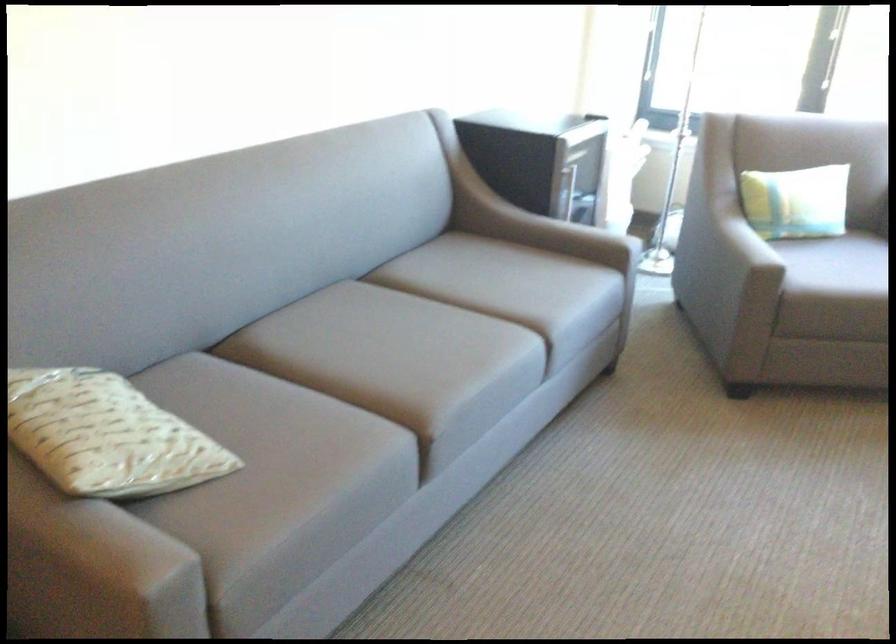
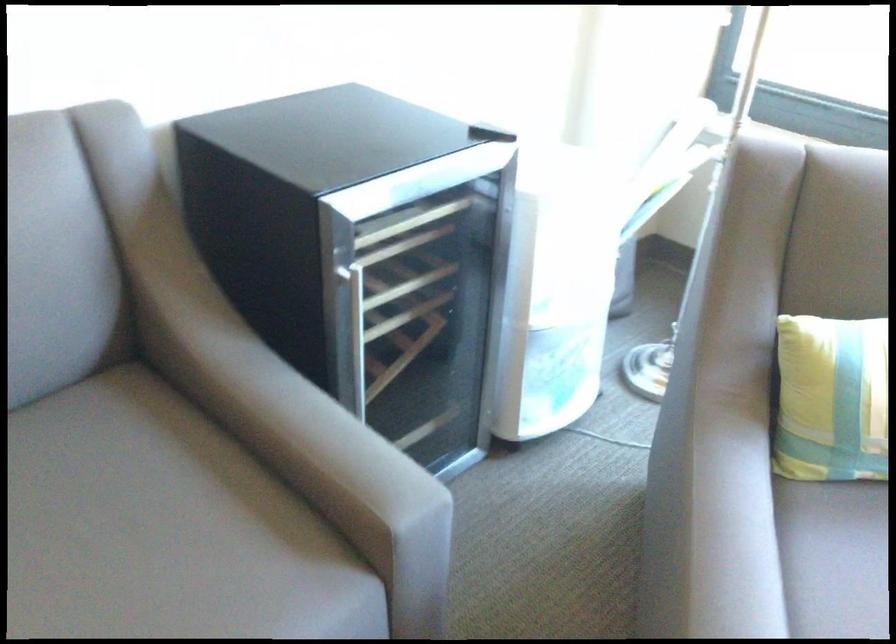
Where in the second image is the point corresponding to point (459, 289) from the first image?

(83, 529)